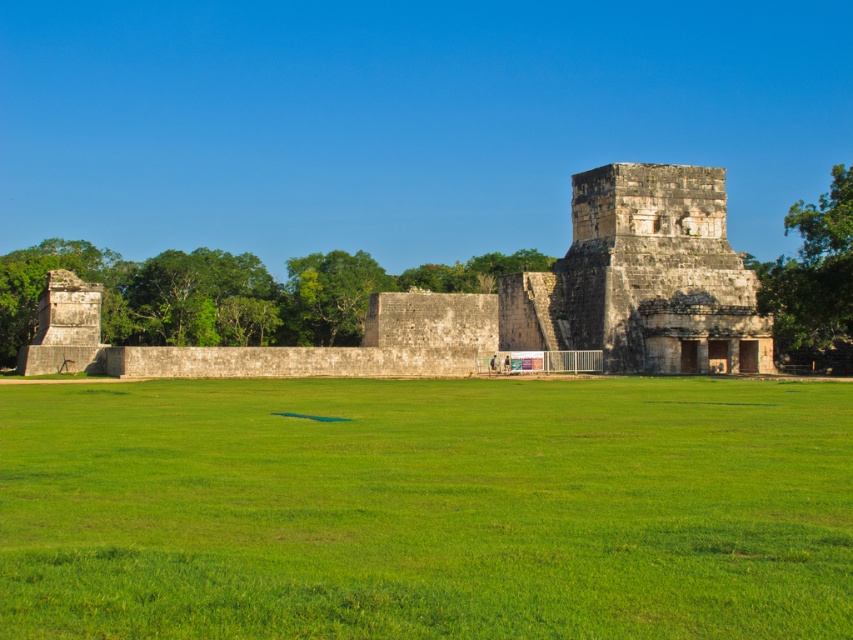
Looking at this image, you are standing in the middle of the field and see the green grass at center. If you walk straight ahead, will you eventually reach the ancient stone structures?

Yes, because the green grass at center is located at point (426, 508), which is in the central path leading towards the ancient stone structures in the background.

You are standing in the field and want to take a photo of the stone ruins at center. Since the green grass at center is blocking your view, can you step back to get a clear shot without the grass in the foreground?

The green grass at center is in front of the stone ruins at center, so stepping back might still keep both in frame. Move sideways instead to avoid the grass.